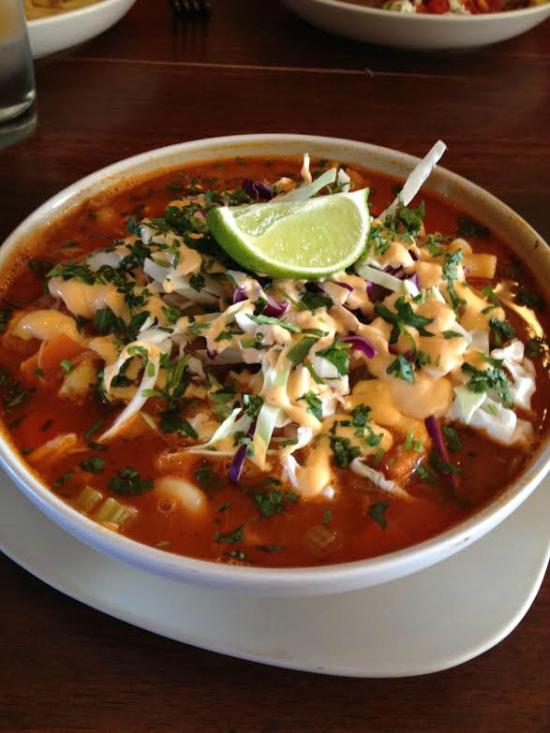
Locate an element on the screen. Image resolution: width=550 pixels, height=733 pixels. glass is located at coordinates (25, 69).